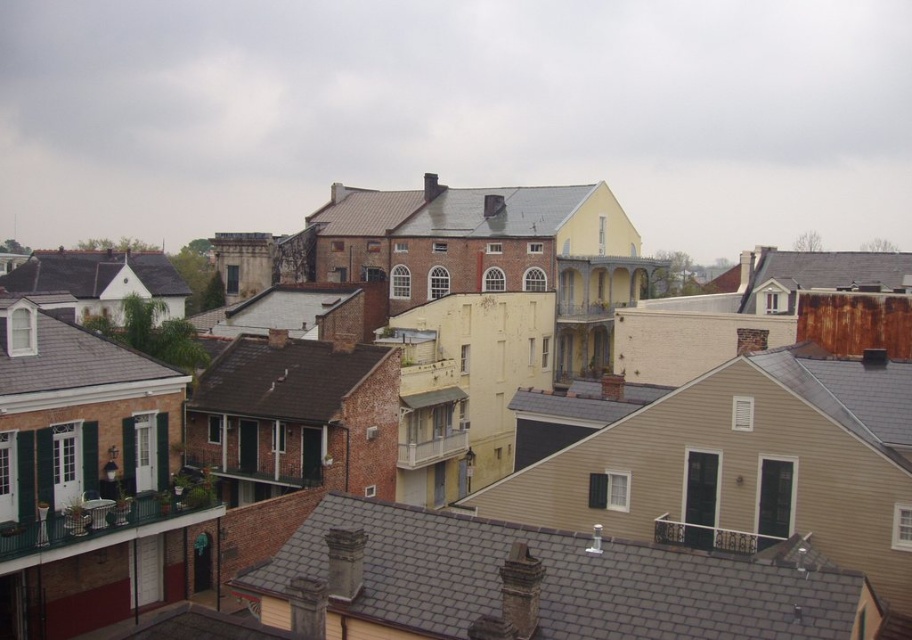
You are standing in the historic district and want to take a photo that includes both the point at coordinates point (288, 545) and point (268, 406). Which point should you focus on first to ensure both are in the frame?

You should focus on point (288, 545) first because it is closer to you than point (268, 406), ensuring both points are within the camera frame.

You are an architect analyzing the rooftop layout of this historic district. You notice the gray slate roof at center. Can you determine its exact position in the image using coordinates?

The gray slate roof at center is located at coordinates point (536,582).

You are an urban planner assessing the rooftops in this historic district. Given the gray slate roof at center and the brown brick roof at center, which one has a greater width?

The gray slate roof at center has a greater width than the brown brick roof at center according to the description.